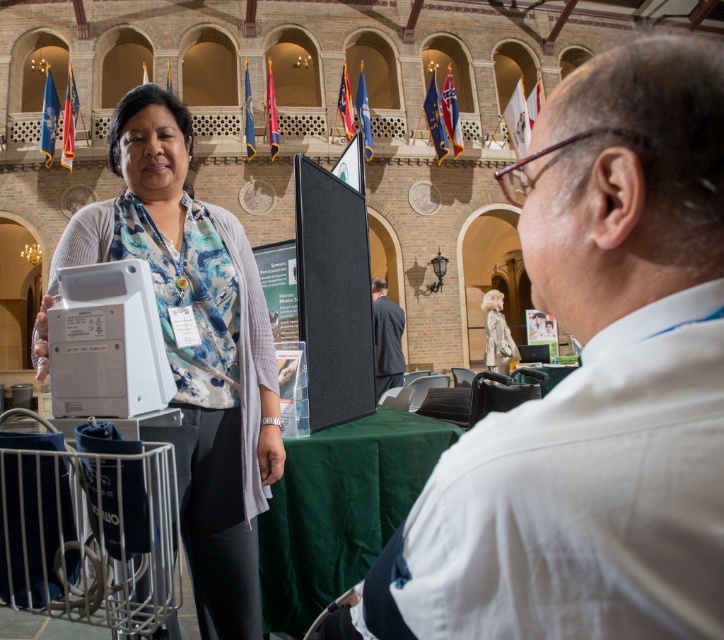
Question: Which object appears farthest from the camera in this image?

Choices:
 (A) dark gray suit at center
 (B) light beige fabric coat at center
 (C) white shirt at upper right

Answer: (B)

Question: Based on their relative distances, which object is nearer to the white shirt at upper right?

Choices:
 (A) dark gray suit at center
 (B) white matte laptop at center
 (C) light beige fabric coat at center

Answer: (B)

Question: Does white shirt at upper right have a smaller size compared to white matte laptop at center?

Choices:
 (A) no
 (B) yes

Answer: (A)

Question: Among these points, which one is farthest from the camera?

Choices:
 (A) (392, 360)
 (B) (214, 506)

Answer: (A)

Question: In this image, where is dark gray suit at center located relative to light beige fabric coat at center?

Choices:
 (A) right
 (B) left

Answer: (B)

Question: Is white shirt at upper right below white matte laptop at center?

Choices:
 (A) yes
 (B) no

Answer: (B)